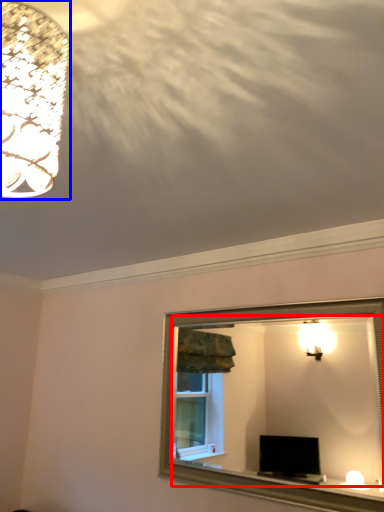
Question: Which of the following is the farthest to the observer, mirror (highlighted by a red box) or lamp (highlighted by a blue box)?

Choices:
 (A) mirror
 (B) lamp

Answer: (A)